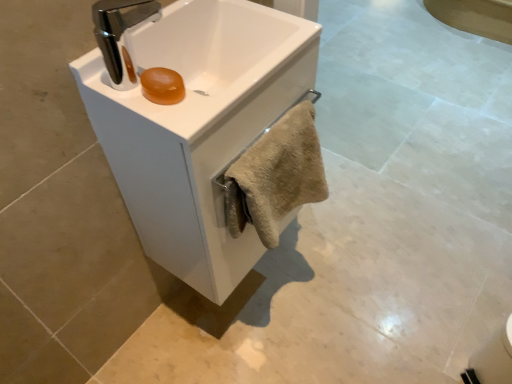
Question: From a real-world perspective, does white glossy sink at center, the 2th sink positioned from the back, stand above white glossy sink at center, marked as the 1th sink in a back-to-front arrangement?

Choices:
 (A) no
 (B) yes

Answer: (B)

Question: From a real-world perspective, does white glossy sink at center, the first sink viewed from the front, sit lower than white glossy sink at center, arranged as the second sink when viewed from the front?

Choices:
 (A) no
 (B) yes

Answer: (A)

Question: Does white glossy sink at center, the 2th sink positioned from the back, have a smaller size compared to white glossy sink at center, marked as the 1th sink in a back-to-front arrangement?

Choices:
 (A) no
 (B) yes

Answer: (B)

Question: Does white glossy sink at center, the 2th sink positioned from the back, come in front of white glossy sink at center, marked as the 1th sink in a back-to-front arrangement?

Choices:
 (A) no
 (B) yes

Answer: (B)

Question: Can you confirm if white glossy sink at center, the first sink viewed from the front, is thinner than white glossy sink at center, arranged as the second sink when viewed from the front?

Choices:
 (A) yes
 (B) no

Answer: (A)

Question: Does point (185, 264) appear closer or farther from the camera than point (313, 134)?

Choices:
 (A) closer
 (B) farther

Answer: (B)

Question: From the image's perspective, is white glossy sink at center, arranged as the second sink when viewed from the front, above or below beige fuzzy towel at center?

Choices:
 (A) above
 (B) below

Answer: (B)

Question: In the image, is white glossy sink at center, marked as the 1th sink in a back-to-front arrangement, positioned in front of or behind beige fuzzy towel at center?

Choices:
 (A) behind
 (B) front

Answer: (B)

Question: Considering the positions of white glossy sink at center, arranged as the second sink when viewed from the front, and beige fuzzy towel at center in the image, is white glossy sink at center, arranged as the second sink when viewed from the front, wider or thinner than beige fuzzy towel at center?

Choices:
 (A) thin
 (B) wide

Answer: (B)

Question: Considering the relative positions of white glossy sink at center, arranged as the second sink when viewed from the front, and white glossy sink at center, the first sink viewed from the front, in the image provided, is white glossy sink at center, arranged as the second sink when viewed from the front, to the left or to the right of white glossy sink at center, the first sink viewed from the front,?

Choices:
 (A) right
 (B) left

Answer: (A)

Question: Does point (210, 294) appear closer or farther from the camera than point (282, 23)?

Choices:
 (A) farther
 (B) closer

Answer: (A)

Question: Considering the positions of white glossy sink at center, arranged as the second sink when viewed from the front, and white glossy sink at center, the 2th sink positioned from the back, in the image, is white glossy sink at center, arranged as the second sink when viewed from the front, wider or thinner than white glossy sink at center, the 2th sink positioned from the back,?

Choices:
 (A) thin
 (B) wide

Answer: (B)

Question: From a real-world perspective, is white glossy sink at center, marked as the 1th sink in a back-to-front arrangement, above or below white glossy sink at center, the 2th sink positioned from the back?

Choices:
 (A) below
 (B) above

Answer: (A)

Question: Looking at the image, does white glossy sink at center, the 2th sink positioned from the back, seem bigger or smaller compared to beige fuzzy towel at center?

Choices:
 (A) small
 (B) big

Answer: (B)

Question: In terms of height, does white glossy sink at center, the first sink viewed from the front, look taller or shorter compared to beige fuzzy towel at center?

Choices:
 (A) tall
 (B) short

Answer: (B)